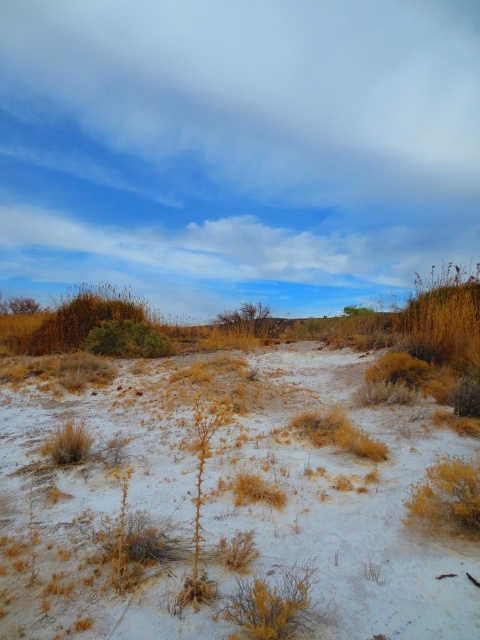
Between white sandy soil at center and dry grass at center, which one appears on the right side from the viewer's perspective?

dry grass at center

Does white sandy soil at center have a lesser width compared to dry grass at center?

No.

Is point (112, 506) farther from viewer compared to point (195, 563)?

That is True.

I want to click on white sandy soil at center, so click(x=226, y=509).